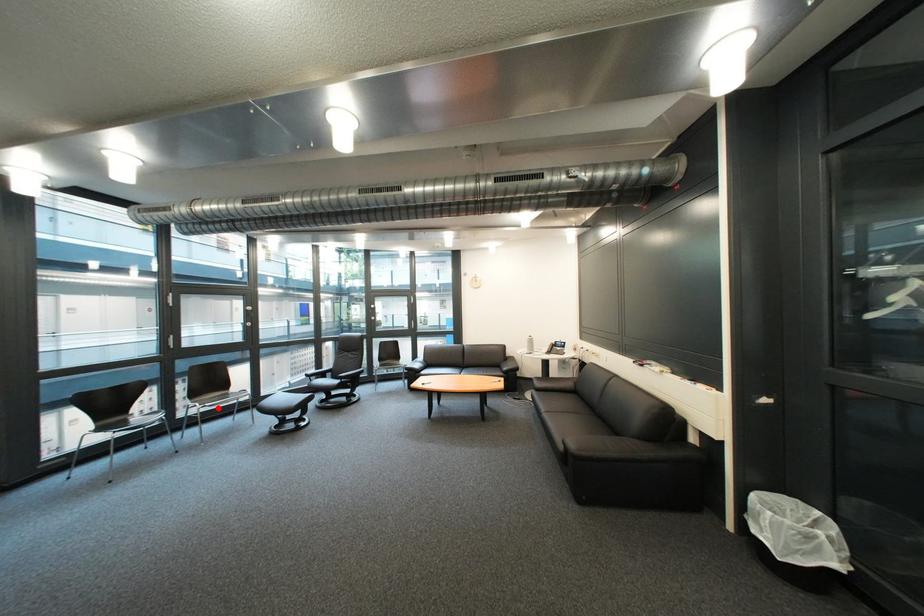
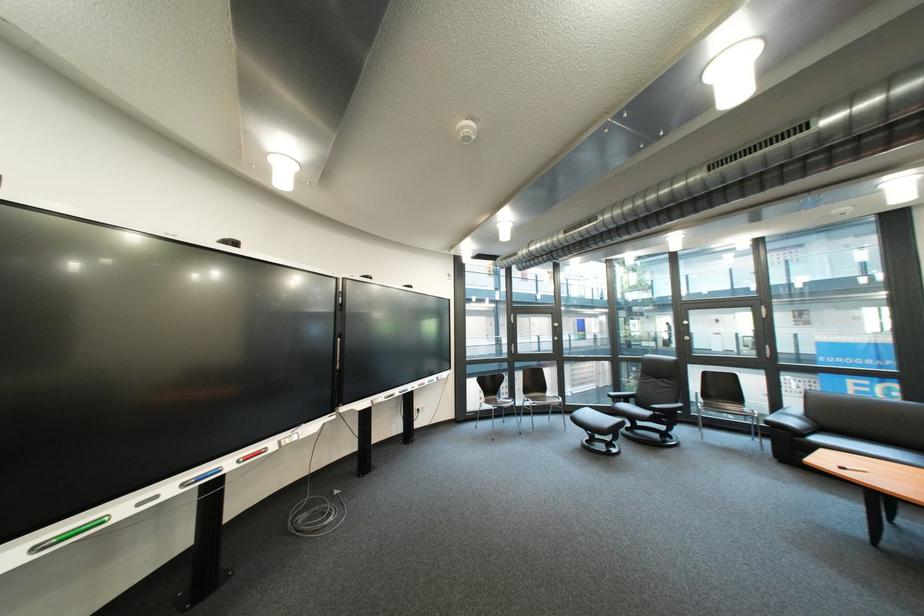
Locate, in the second image, the point that corresponds to the highlighted location in the first image.

(548, 405)